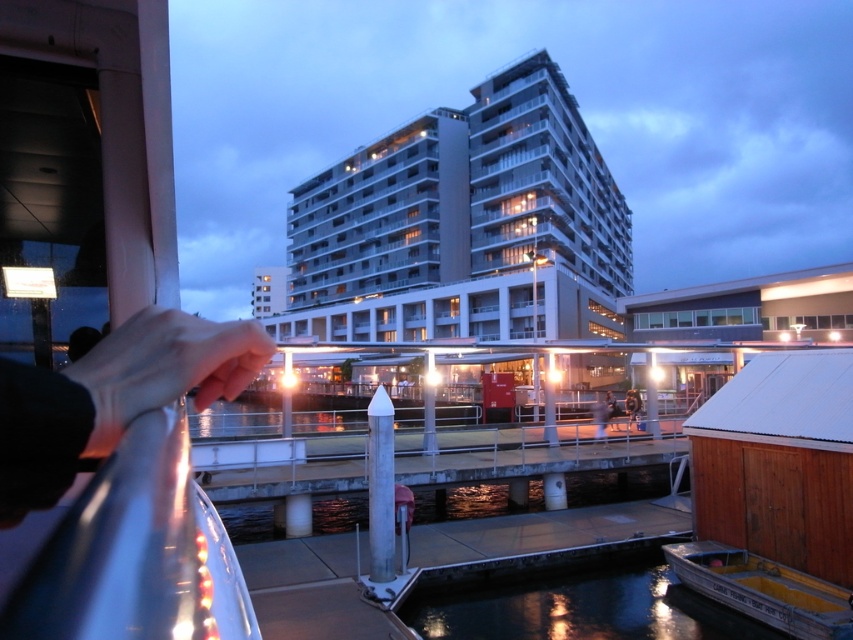
Who is taller, dark reflective water at lower center or metallic yellow boat at lower right?

With more height is metallic yellow boat at lower right.

Can you confirm if dark reflective water at lower center is taller than metallic yellow boat at lower right?

Incorrect, dark reflective water at lower center's height is not larger of metallic yellow boat at lower right's.

The image size is (853, 640). What are the coordinates of `dark reflective water at lower center` in the screenshot? It's located at (579, 609).

Measure the distance between metallic yellow boat at lower right and camera.

metallic yellow boat at lower right and camera are 30.52 feet apart from each other.

Between point (769, 600) and point (612, 404), which one is positioned in front?

Positioned in front is point (769, 600).

What do you see at coordinates (763, 589) in the screenshot?
I see `metallic yellow boat at lower right` at bounding box center [763, 589].

This screenshot has width=853, height=640. What are the coordinates of `metallic yellow boat at lower right` in the screenshot? It's located at (763, 589).

Identify the location of white concrete building at center. (463, 227).

Is white concrete building at center positioned before smooth skin person at center?

No, white concrete building at center is behind smooth skin person at center.

Identify the location of white concrete building at center. (463, 227).

This screenshot has width=853, height=640. In order to click on white concrete building at center in this screenshot , I will do `click(463, 227)`.